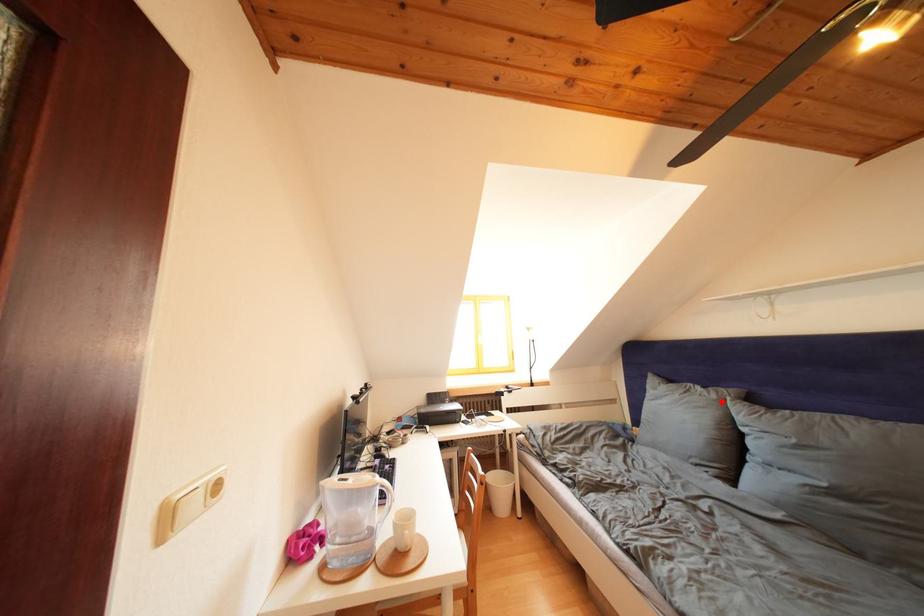
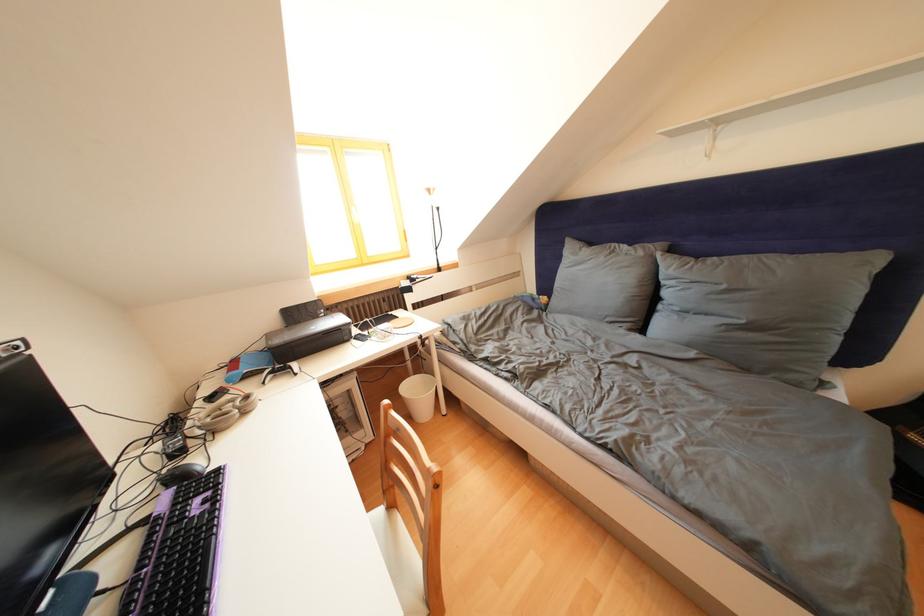
In the second image, find the point that corresponds to the highlighted location in the first image.

(649, 259)